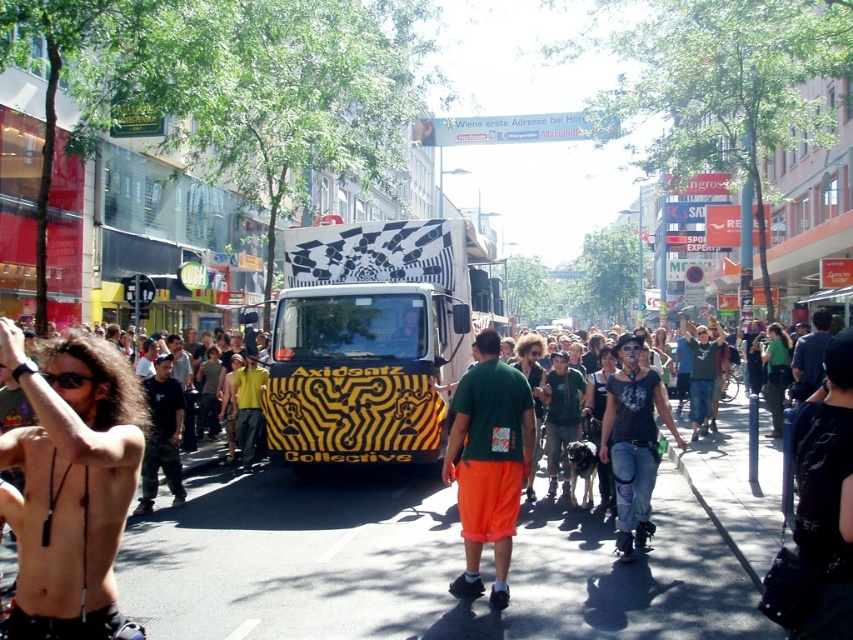
You are standing at the point with coordinates point (x=402, y=332) and want to walk towards the point with coordinates point (x=425, y=419). Which direction should you walk relative to the Axiomatz Collective truck?

You should walk towards the front of the Axiomatz Collective truck because point (x=425, y=419) is in front of point (x=402, y=332).

You are standing at the point with coordinates point (421, 305) and want to walk to the point with coordinates point (828, 310). Is the point you want to reach in front of or behind you?

The point you want to reach, point (828, 310), is behind point (421, 305), so it is behind you.